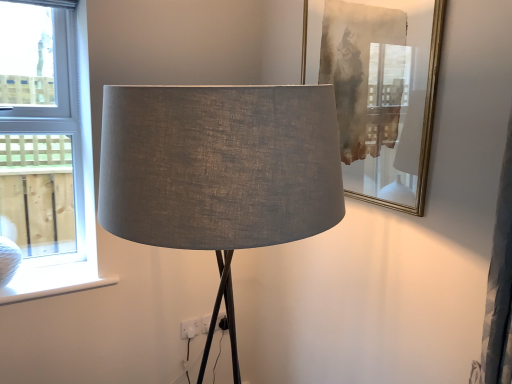
Question: Is matte gold picture frame at upper right thinner than white plastic electric outlet at lower center?

Choices:
 (A) yes
 (B) no

Answer: (B)

Question: Is matte gold picture frame at upper right in front of white plastic electric outlet at lower center?

Choices:
 (A) no
 (B) yes

Answer: (B)

Question: Would you say matte gold picture frame at upper right is outside white plastic electric outlet at lower center?

Choices:
 (A) no
 (B) yes

Answer: (B)

Question: Is matte gold picture frame at upper right looking in the opposite direction of white plastic electric outlet at lower center?

Choices:
 (A) yes
 (B) no

Answer: (B)

Question: Can you confirm if matte gold picture frame at upper right is bigger than white plastic electric outlet at lower center?

Choices:
 (A) yes
 (B) no

Answer: (A)

Question: Is white matte window sill at lower left in front of or behind matte gray fabric lampshade at center in the image?

Choices:
 (A) front
 (B) behind

Answer: (B)

Question: Which is correct: white matte window sill at lower left is inside matte gray fabric lampshade at center, or outside of it?

Choices:
 (A) inside
 (B) outside

Answer: (B)

Question: In the image, is white matte window sill at lower left on the left side or the right side of matte gray fabric lampshade at center?

Choices:
 (A) left
 (B) right

Answer: (A)

Question: Considering the positions of white matte window sill at lower left and matte gray fabric lampshade at center in the image, is white matte window sill at lower left taller or shorter than matte gray fabric lampshade at center?

Choices:
 (A) tall
 (B) short

Answer: (B)

Question: Considering the positions of white matte window sill at lower left and white plastic window at left in the image, is white matte window sill at lower left wider or thinner than white plastic window at left?

Choices:
 (A) thin
 (B) wide

Answer: (B)

Question: From a real-world perspective, is white matte window sill at lower left physically located above or below white plastic window at left?

Choices:
 (A) above
 (B) below

Answer: (B)

Question: Based on their sizes in the image, would you say white matte window sill at lower left is bigger or smaller than white plastic window at left?

Choices:
 (A) small
 (B) big

Answer: (A)

Question: Do you think white matte window sill at lower left is within white plastic window at left, or outside of it?

Choices:
 (A) inside
 (B) outside

Answer: (A)

Question: In terms of width, does white plastic window at left look wider or thinner when compared to matte gray fabric lampshade at center?

Choices:
 (A) thin
 (B) wide

Answer: (A)

Question: In terms of height, does white plastic window at left look taller or shorter compared to matte gray fabric lampshade at center?

Choices:
 (A) short
 (B) tall

Answer: (B)